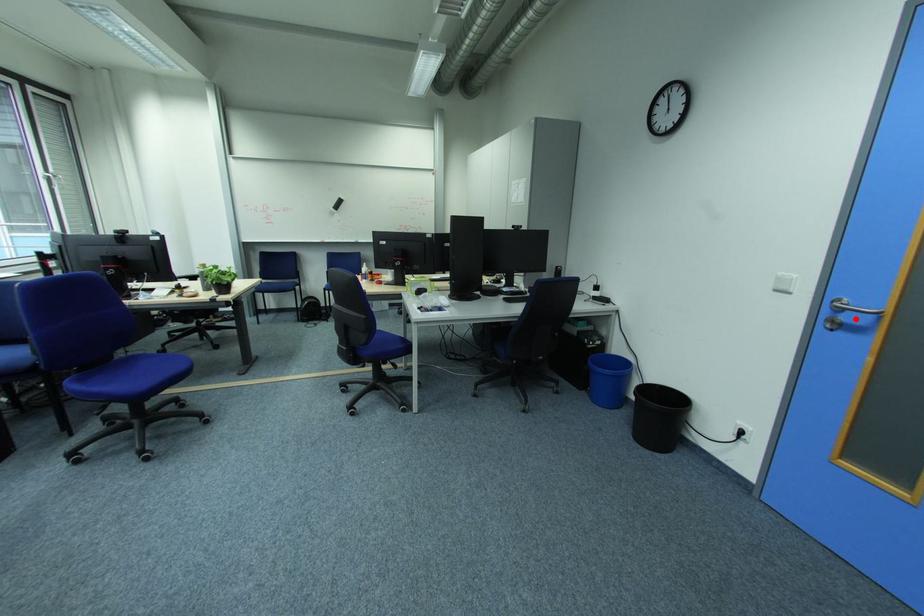
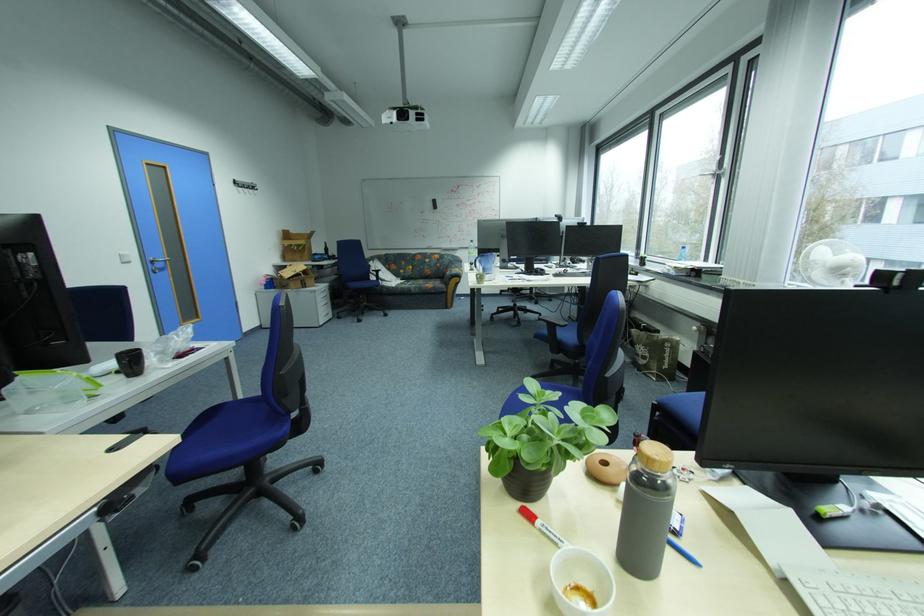
Locate, in the second image, the point that corresponds to the highlighted location in the first image.

(167, 265)